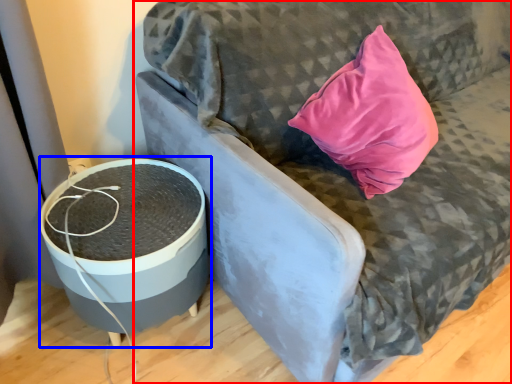
Question: Which of the following is the closest to the observer, furniture (highlighted by a red box) or round table (highlighted by a blue box)?

Choices:
 (A) furniture
 (B) round table

Answer: (A)